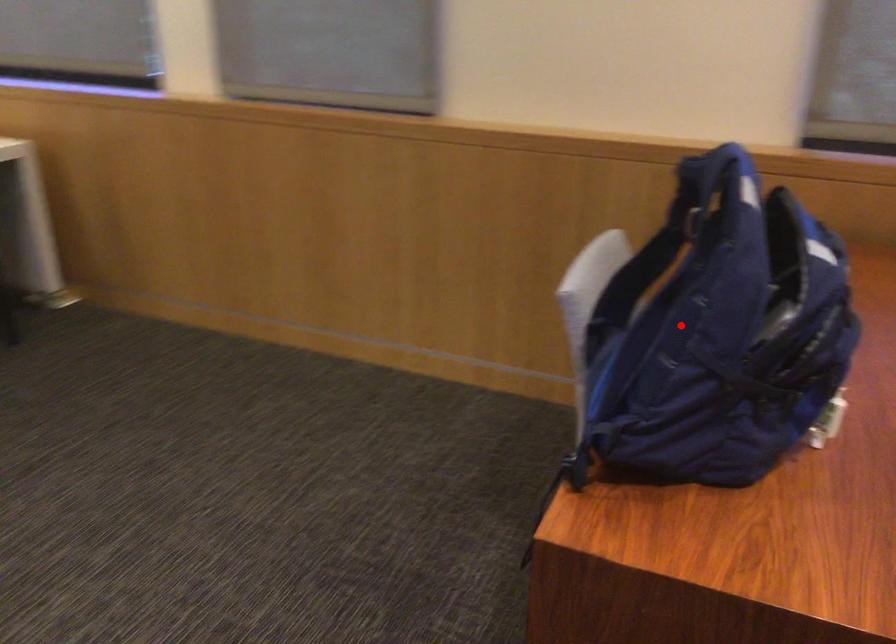
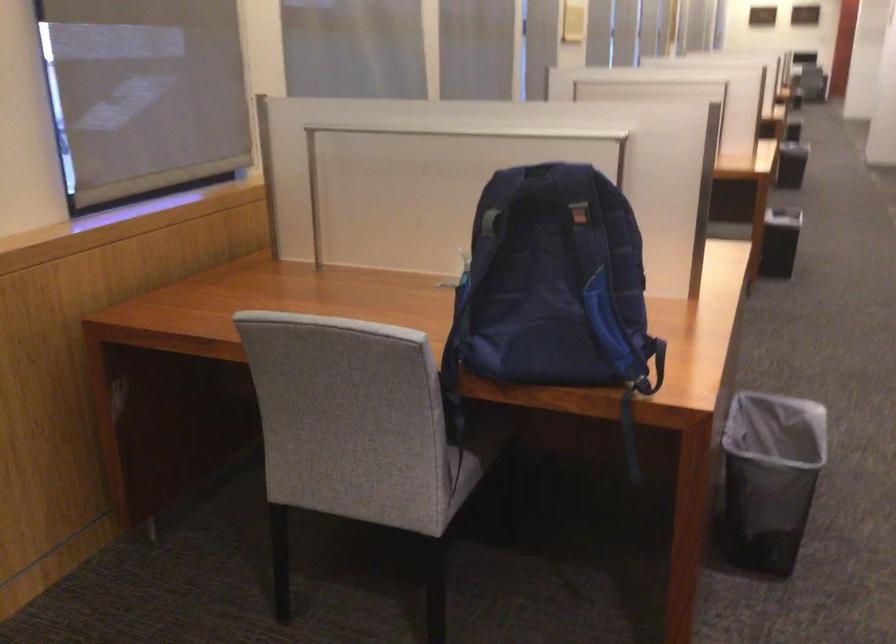
Question: I am providing you with two images of the same scene from different viewpoints. A red point is marked on the first image. Is the red point's position out of view in image 2?

Choices:
 (A) Yes
 (B) No

Answer: (B)